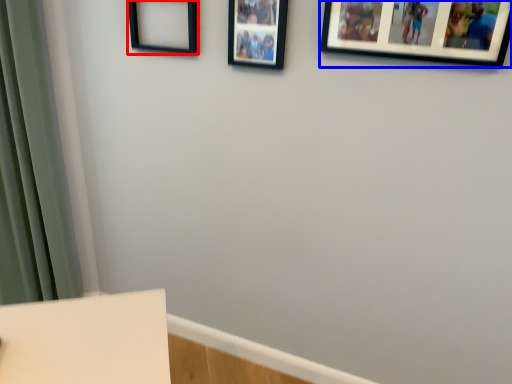
Question: Which object is closer to the camera taking this photo, picture frame (highlighted by a red box) or picture frame (highlighted by a blue box)?

Choices:
 (A) picture frame
 (B) picture frame

Answer: (B)